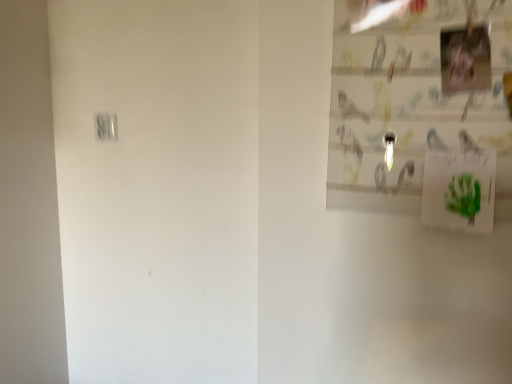
Question: Would you say white plastic light switch at upper left is a long distance from green paper postcard at upper right?

Choices:
 (A) no
 (B) yes

Answer: (A)

Question: Does white plastic light switch at upper left have a lesser height compared to green paper postcard at upper right?

Choices:
 (A) yes
 (B) no

Answer: (A)

Question: Can you confirm if white plastic light switch at upper left is thinner than green paper postcard at upper right?

Choices:
 (A) yes
 (B) no

Answer: (A)

Question: Is white plastic light switch at upper left wider than green paper postcard at upper right?

Choices:
 (A) yes
 (B) no

Answer: (B)

Question: Does white plastic light switch at upper left appear on the left side of green paper postcard at upper right?

Choices:
 (A) no
 (B) yes

Answer: (B)

Question: Does white plastic light switch at upper left contain green paper postcard at upper right?

Choices:
 (A) yes
 (B) no

Answer: (B)

Question: Is green paper postcard at upper right thinner than white plastic light switch at upper left?

Choices:
 (A) yes
 (B) no

Answer: (B)

Question: From the image's perspective, is green paper postcard at upper right under white plastic light switch at upper left?

Choices:
 (A) no
 (B) yes

Answer: (B)

Question: Is green paper postcard at upper right not close to white plastic light switch at upper left?

Choices:
 (A) yes
 (B) no

Answer: (B)

Question: Can you confirm if green paper postcard at upper right is smaller than white plastic light switch at upper left?

Choices:
 (A) yes
 (B) no

Answer: (B)

Question: Considering the relative sizes of green paper postcard at upper right and white plastic light switch at upper left in the image provided, is green paper postcard at upper right bigger than white plastic light switch at upper left?

Choices:
 (A) no
 (B) yes

Answer: (B)

Question: Is green paper postcard at upper right oriented towards white plastic light switch at upper left?

Choices:
 (A) yes
 (B) no

Answer: (B)

Question: Looking at the image, does green paper postcard at upper right seem bigger or smaller compared to white plastic light switch at upper left?

Choices:
 (A) small
 (B) big

Answer: (B)